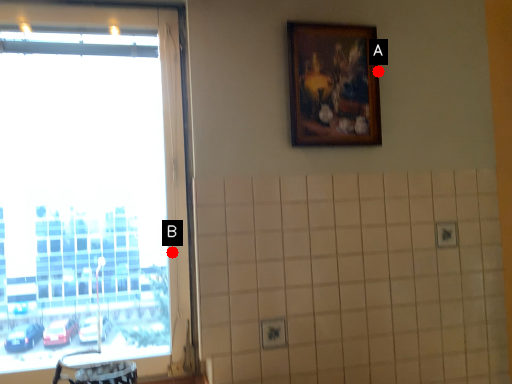
Question: Two points are circled on the image, labeled by A and B beside each circle. Which of the following is the closest to the observer?

Choices:
 (A) A is closer
 (B) B is closer

Answer: (B)